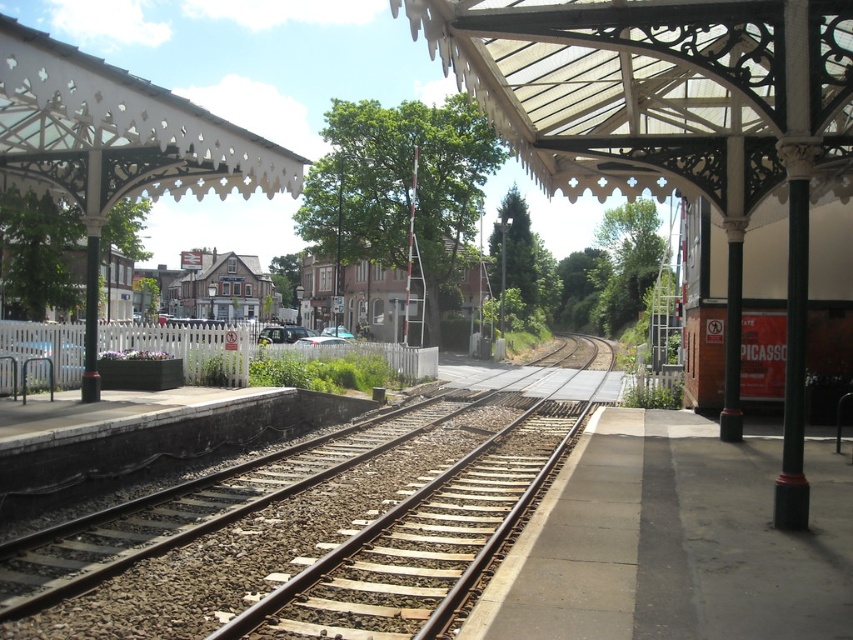
Question: Which object is farther from the camera taking this photo?

Choices:
 (A) brown gravel train track at center
 (B) concrete platform at center

Answer: (A)

Question: Can you confirm if brown gravel train track at center is wider than concrete platform at center?

Choices:
 (A) no
 (B) yes

Answer: (B)

Question: Can you confirm if brown gravel train track at center is wider than concrete platform at center?

Choices:
 (A) yes
 (B) no

Answer: (A)

Question: Among these points, which one is farthest from the camera?

Choices:
 (A) (32, 544)
 (B) (624, 504)

Answer: (B)

Question: Does brown gravel train track at center have a larger size compared to concrete platform at center?

Choices:
 (A) no
 (B) yes

Answer: (B)